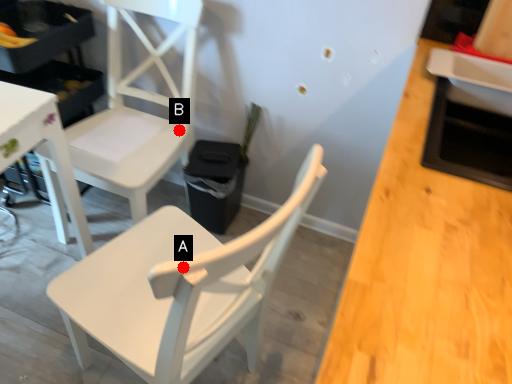
Question: Two points are circled on the image, labeled by A and B beside each circle. Which of the following is the closest to the observer?

Choices:
 (A) A is closer
 (B) B is closer

Answer: (A)